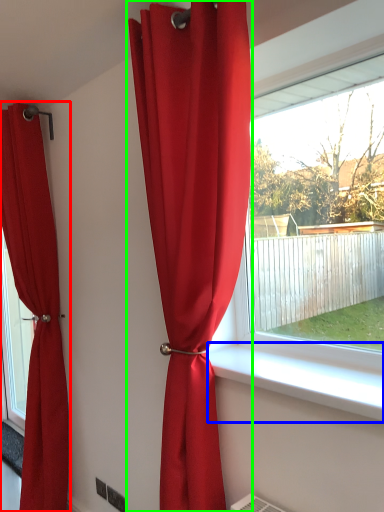
Question: Based on their relative distances, which object is nearer to curtain (highlighted by a red box)? Choose from window sill (highlighted by a blue box) and curtain (highlighted by a green box).

Choices:
 (A) window sill
 (B) curtain

Answer: (B)